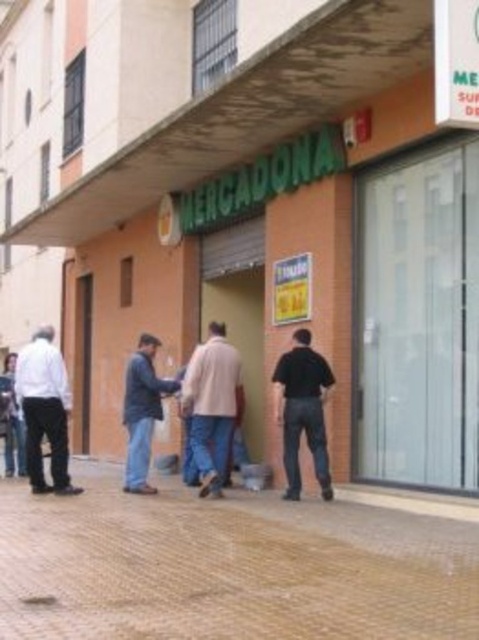
You are a delivery person who needs to place a large box on the ground near the light beige coat at center. The box requires a stable surface. Can you place it on the brown brick pavement at center? Explain why or why not.

The brown brick pavement at center is 6.12 feet from the light beige coat at center. Since the pavement is a stable surface and the distance is sufficient, you can place the box there as it is close enough and the brick pavement provides a solid base.

Consider the image. You are a photographer trying to capture a candid shot of the black matte shirt at center without including the light beige coat at center in the frame. Is this possible given their positions?

The black matte shirt at center is behind the light beige coat at center, so it might be challenging to capture the black matte shirt at center without the light beige coat at center blocking the view unless you position yourself at an angle or move closer to the subject.